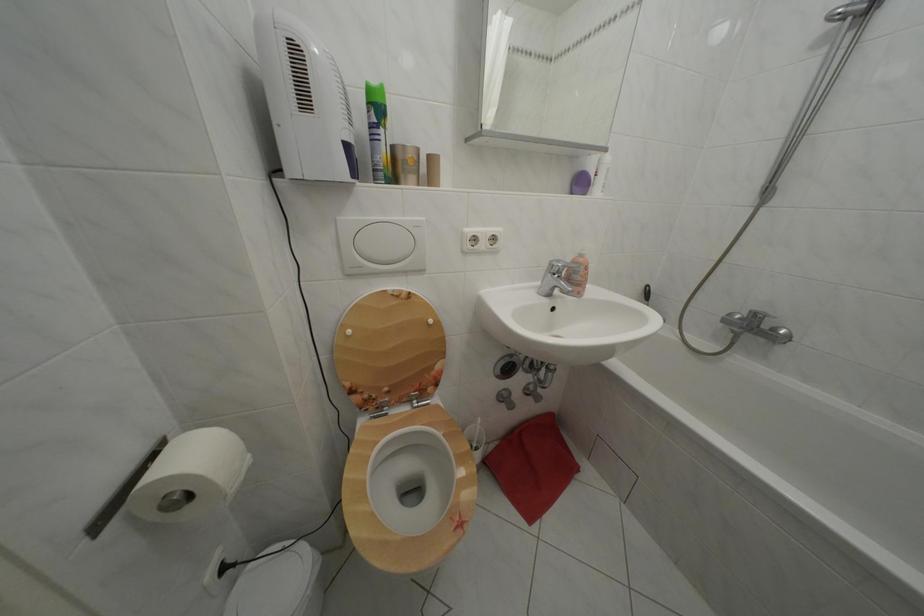
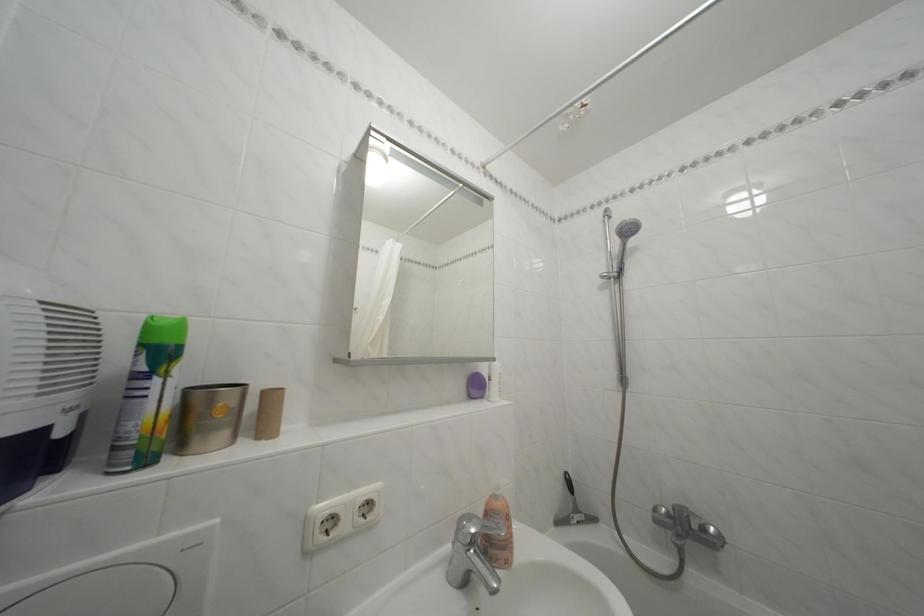
How did the camera likely rotate?

The camera's rotation is toward right-up.